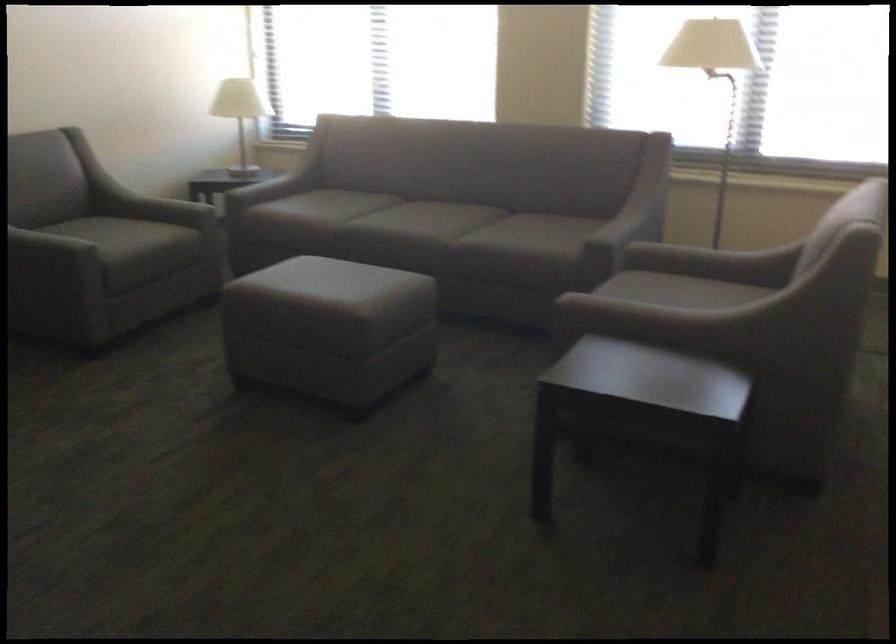
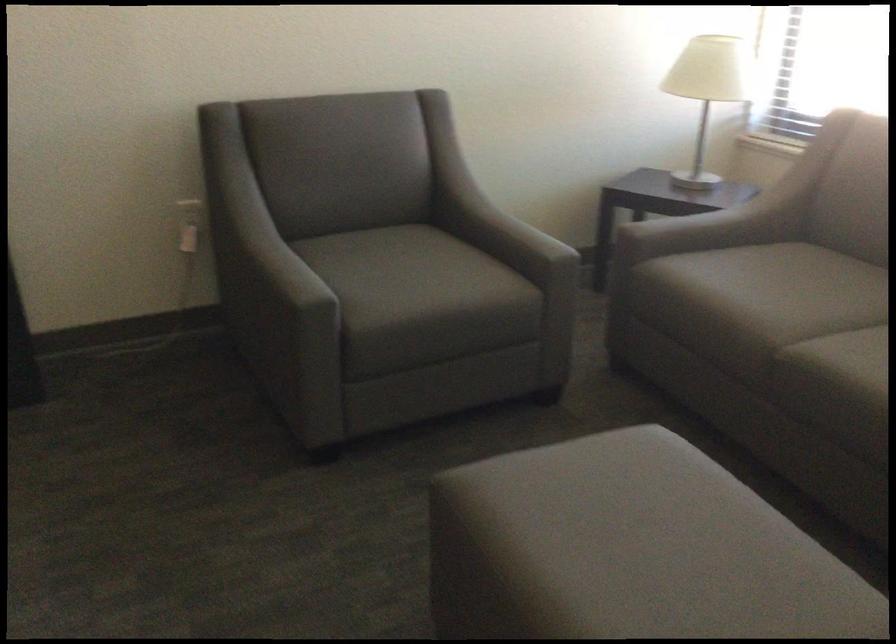
Question: I am providing you with two images of the same scene from different viewpoints. Please identify which objects are invisible in image2.

Choices:
 (A) white table lamp
 (B) ottoman top surface
 (C) white electrical outlet
 (D) none of these

Answer: (D)